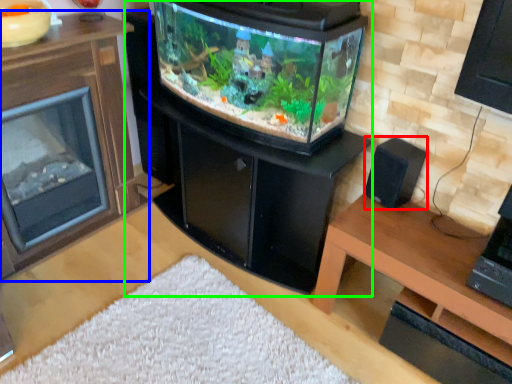
Question: Estimate the real-world distances between objects in this image. Which object is farther from speaker (highlighted by a red box), furniture (highlighted by a blue box) or fireplace (highlighted by a green box)?

Choices:
 (A) furniture
 (B) fireplace

Answer: (A)